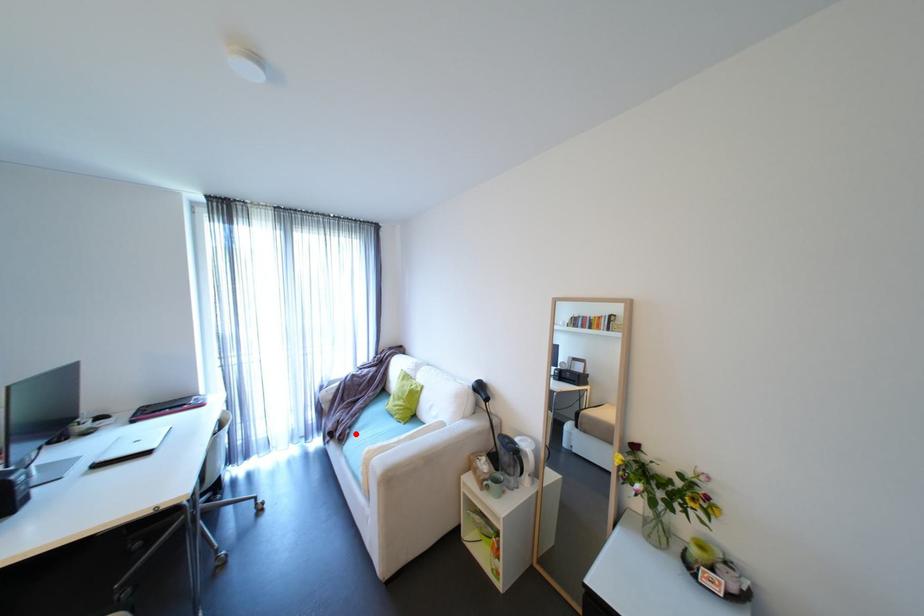
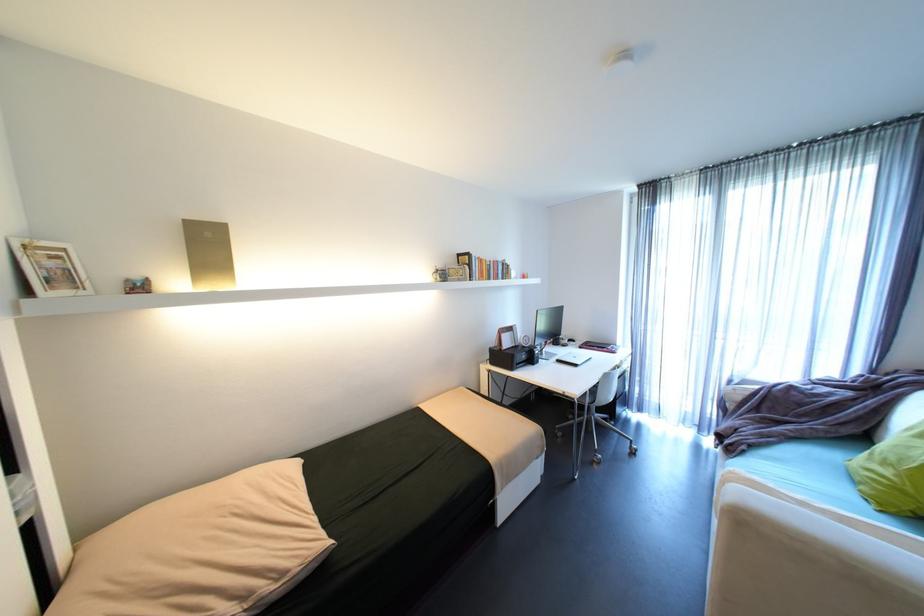
Question: I am providing you with two images of the same scene from different viewpoints. Image1 has a red point marked. In image2, the corresponding 3D location appears at what relative position? Reply with the corresponding letter.

Choices:
 (A) Closer
 (B) Farther

Answer: (A)